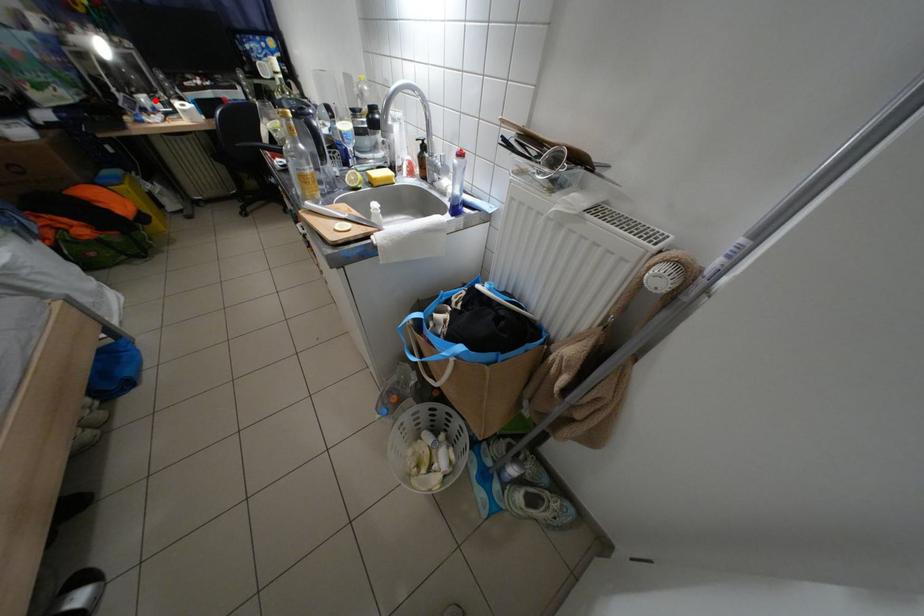
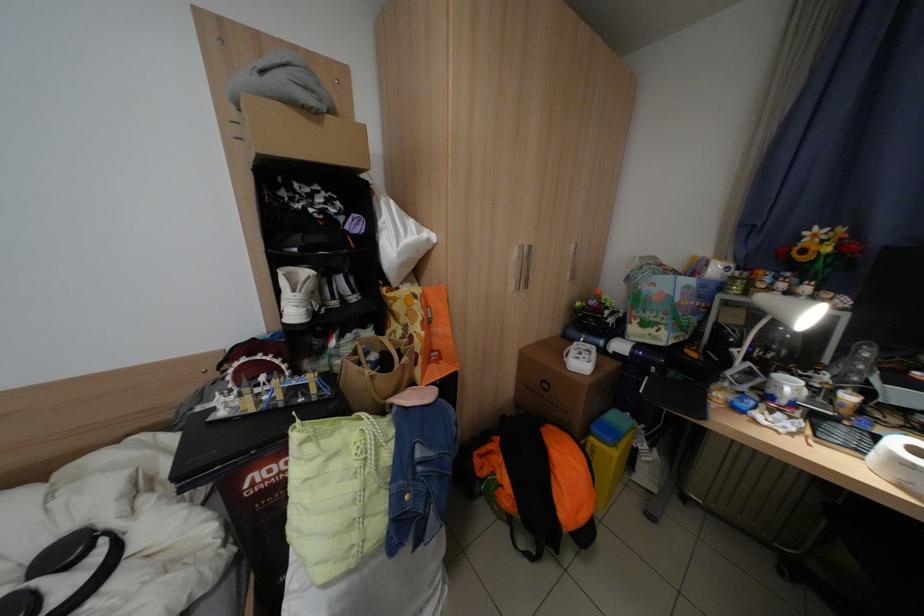
Locate, in the second image, the point that corresponds to the highlighted location in the first image.

(800, 387)